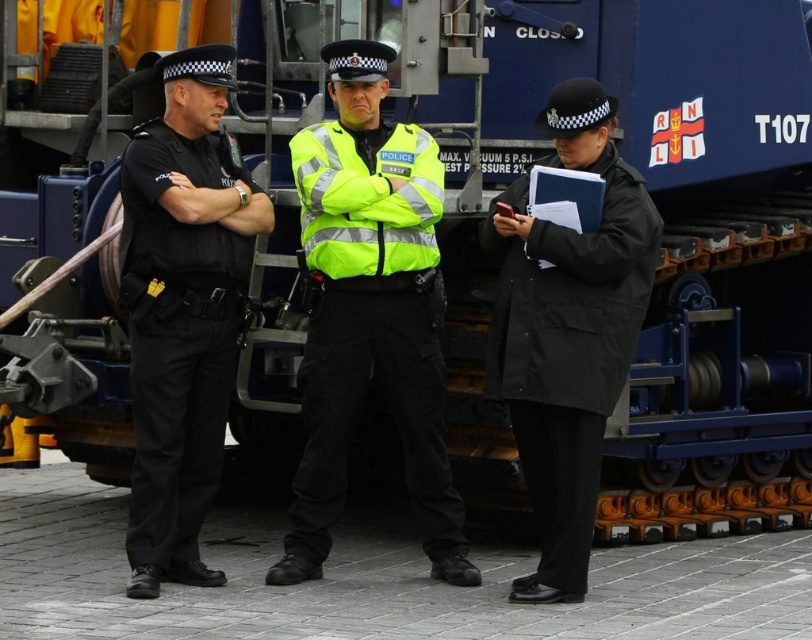
Who is positioned more to the left, black uniform at left or black matte coat at center?

Positioned to the left is black uniform at left.

Measure the distance between black uniform at left and black matte coat at center.

They are 2.40 meters apart.

Between point (229, 189) and point (633, 196), which one is positioned behind?

The point (229, 189) is behind.

The height and width of the screenshot is (640, 812). I want to click on black uniform at left, so click(182, 310).

Is neon yellow reflective jacket at center smaller than black uniform at left?

Yes.

Is point (387, 161) behind point (173, 448)?

Yes, point (387, 161) is behind point (173, 448).

Between point (392, 312) and point (203, 257), which one is positioned behind?

Point (392, 312)

Where is `neon yellow reflective jacket at center`? The width and height of the screenshot is (812, 640). neon yellow reflective jacket at center is located at coordinates (369, 310).

Does point (456, 548) lie in front of point (562, 310)?

No.

Between point (316, 496) and point (564, 368), which one is positioned behind?

The point (316, 496) is behind.

This screenshot has width=812, height=640. What are the coordinates of `neon yellow reflective jacket at center` in the screenshot? It's located at (369, 310).